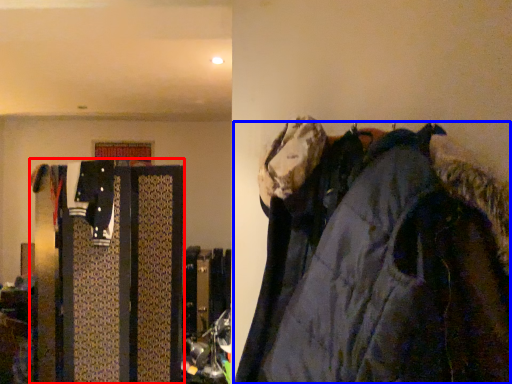
Question: Which object is closer to the camera taking this photo, closet (highlighted by a red box) or jacket (highlighted by a blue box)?

Choices:
 (A) closet
 (B) jacket

Answer: (B)